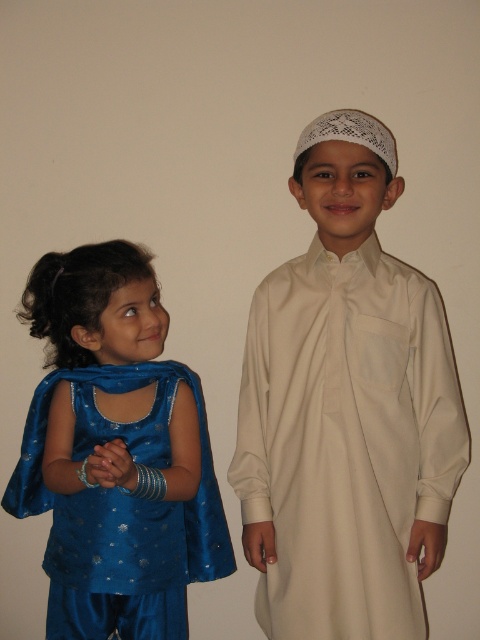
Question: Can you confirm if white matte kufi at center is positioned to the left of shiny blue dress at left?

Choices:
 (A) no
 (B) yes

Answer: (A)

Question: Is white matte kufi at center positioned at the back of shiny blue dress at left?

Choices:
 (A) no
 (B) yes

Answer: (B)

Question: Can you confirm if white matte kufi at center is positioned to the right of shiny blue dress at left?

Choices:
 (A) no
 (B) yes

Answer: (B)